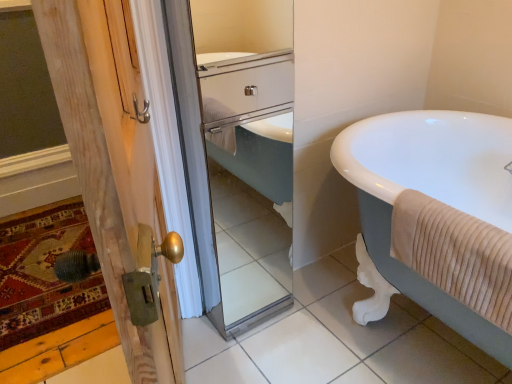
Question: Is wooden door at left in contact with beige ribbed towel at right?

Choices:
 (A) yes
 (B) no

Answer: (B)

Question: Is wooden door at left behind beige ribbed towel at right?

Choices:
 (A) no
 (B) yes

Answer: (A)

Question: From a real-world perspective, does wooden door at left sit lower than beige ribbed towel at right?

Choices:
 (A) no
 (B) yes

Answer: (B)

Question: Does wooden door at left have a lesser width compared to beige ribbed towel at right?

Choices:
 (A) no
 (B) yes

Answer: (A)

Question: Does wooden door at left have a greater width compared to beige ribbed towel at right?

Choices:
 (A) no
 (B) yes

Answer: (B)

Question: Is point (246, 137) closer or farther from the camera than point (463, 240)?

Choices:
 (A) farther
 (B) closer

Answer: (A)

Question: Considering the positions of clear glass mirror at center and beige ribbed towel at right in the image, is clear glass mirror at center taller or shorter than beige ribbed towel at right?

Choices:
 (A) tall
 (B) short

Answer: (A)

Question: In terms of size, does clear glass mirror at center appear bigger or smaller than beige ribbed towel at right?

Choices:
 (A) big
 (B) small

Answer: (A)

Question: In terms of width, does clear glass mirror at center look wider or thinner when compared to beige ribbed towel at right?

Choices:
 (A) wide
 (B) thin

Answer: (A)

Question: Choose the correct answer: Is clear glass mirror at center inside white glossy bathtub at right or outside it?

Choices:
 (A) inside
 (B) outside

Answer: (B)

Question: Is clear glass mirror at center wider or thinner than white glossy bathtub at right?

Choices:
 (A) wide
 (B) thin

Answer: (B)

Question: From the image's perspective, is clear glass mirror at center above or below white glossy bathtub at right?

Choices:
 (A) below
 (B) above

Answer: (B)

Question: In terms of height, does clear glass mirror at center look taller or shorter compared to white glossy bathtub at right?

Choices:
 (A) short
 (B) tall

Answer: (B)

Question: From their relative heights in the image, would you say beige ribbed towel at right is taller or shorter than wooden door at left?

Choices:
 (A) tall
 (B) short

Answer: (B)

Question: In the image, is beige ribbed towel at right positioned in front of or behind wooden door at left?

Choices:
 (A) front
 (B) behind

Answer: (B)